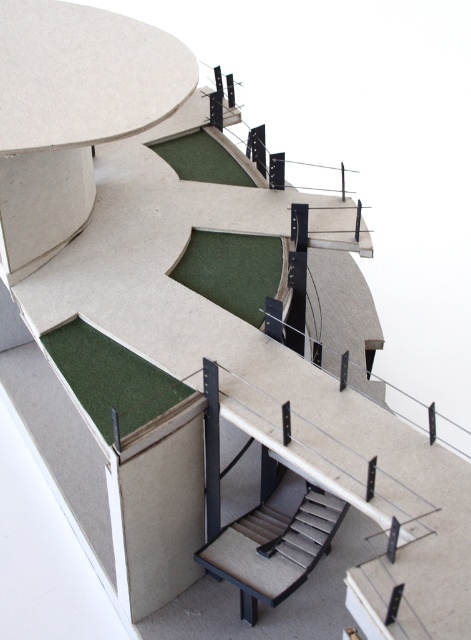
Question: Considering the real-world distances, which object is closest to the green felt carpet at center?

Choices:
 (A) gray fabric stairs at center
 (B) green felt carpet at upper center

Answer: (B)

Question: Can you confirm if gray fabric stairs at center is positioned above green felt carpet at lower left?

Choices:
 (A) yes
 (B) no

Answer: (B)

Question: Estimate the real-world distances between objects in this image. Which object is farther from the green felt carpet at upper center?

Choices:
 (A) green felt carpet at lower left
 (B) green felt carpet at center

Answer: (A)

Question: Which point is farther to the camera?

Choices:
 (A) (338, 522)
 (B) (187, 136)
 (C) (129, 365)

Answer: (B)

Question: In this image, where is green felt carpet at lower left located relative to green felt carpet at upper center?

Choices:
 (A) right
 (B) left

Answer: (B)

Question: Can you confirm if green felt carpet at lower left is positioned below green felt carpet at center?

Choices:
 (A) no
 (B) yes

Answer: (B)